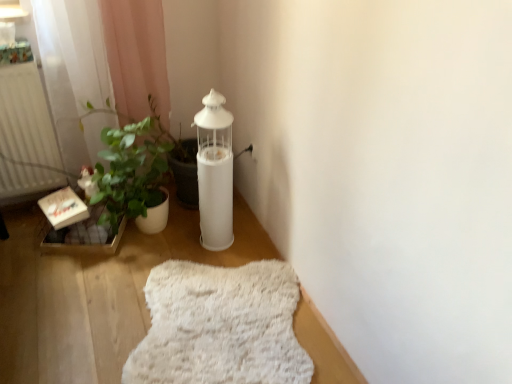
Question: Can you confirm if white fluffy rug at lower center is positioned to the left of white matte radiator at left?

Choices:
 (A) yes
 (B) no

Answer: (B)

Question: Is white fluffy rug at lower center shorter than white matte radiator at left?

Choices:
 (A) yes
 (B) no

Answer: (A)

Question: Is white fluffy rug at lower center smaller than white matte radiator at left?

Choices:
 (A) no
 (B) yes

Answer: (B)

Question: Is white fluffy rug at lower center oriented towards white matte radiator at left?

Choices:
 (A) yes
 (B) no

Answer: (B)

Question: Does white fluffy rug at lower center have a larger size compared to white matte radiator at left?

Choices:
 (A) yes
 (B) no

Answer: (B)

Question: In terms of width, does white fluffy rug at lower center look wider or thinner when compared to white matte radiator at left?

Choices:
 (A) wide
 (B) thin

Answer: (A)

Question: Considering the positions of point (291, 362) and point (24, 180), is point (291, 362) closer or farther from the camera than point (24, 180)?

Choices:
 (A) farther
 (B) closer

Answer: (B)

Question: From the image's perspective, relative to white matte radiator at left, is white fluffy rug at lower center above or below?

Choices:
 (A) below
 (B) above

Answer: (A)

Question: Looking at the image, does white fluffy rug at lower center seem bigger or smaller compared to white matte radiator at left?

Choices:
 (A) small
 (B) big

Answer: (A)

Question: From a real-world perspective, relative to white matte oil lamp at center, is wooden crate at lower left vertically above or below?

Choices:
 (A) below
 (B) above

Answer: (A)

Question: Is wooden crate at lower left inside or outside of white matte oil lamp at center?

Choices:
 (A) outside
 (B) inside

Answer: (A)

Question: Is point (90, 218) closer or farther from the camera than point (200, 236)?

Choices:
 (A) farther
 (B) closer

Answer: (B)

Question: Visually, is wooden crate at lower left positioned to the left or to the right of white matte oil lamp at center?

Choices:
 (A) right
 (B) left

Answer: (B)

Question: From their relative heights in the image, would you say white matte oil lamp at center is taller or shorter than white fluffy rug at lower center?

Choices:
 (A) short
 (B) tall

Answer: (B)

Question: Relative to white fluffy rug at lower center, is white matte oil lamp at center in front or behind?

Choices:
 (A) behind
 (B) front

Answer: (A)